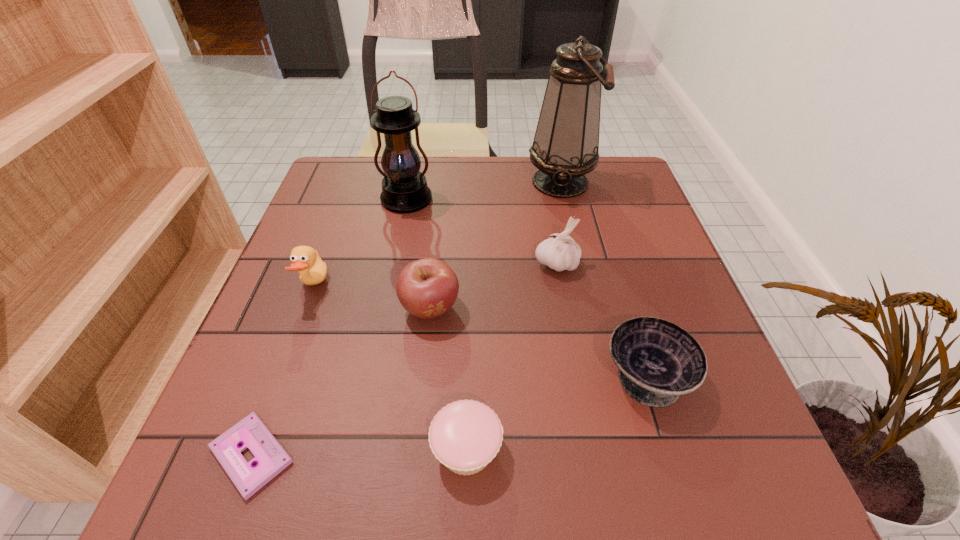
Image resolution: width=960 pixels, height=540 pixels. I want to click on oil lamp, so [566, 143].

This screenshot has width=960, height=540. Identify the location of lantern. click(x=404, y=188).

This screenshot has width=960, height=540. Identify the location of garlic. (560, 252).

Locate an element on the screen. duck is located at coordinates (306, 260).

You are a GUI agent. You are given a task and a screenshot of the screen. Output one action in this format:
    pyautogui.click(x=<x>, y=<y>)
    Task: Click on the apple
    Image resolution: width=960 pixels, height=540 pixels.
    Given the screenshot: What is the action you would take?
    pyautogui.click(x=427, y=288)

You are a GUI agent. You are given a task and a screenshot of the screen. Output one action in this format:
    pyautogui.click(x=<x>, y=<y>)
    Task: Click on the bowl
    The width and height of the screenshot is (960, 540).
    Given the screenshot: What is the action you would take?
    pyautogui.click(x=658, y=361)

The width and height of the screenshot is (960, 540). Find the location of `cupcake`. cupcake is located at coordinates (465, 435).

I want to click on videotape, so click(x=270, y=458).

At what (x,y) coordinates should I click in order to perform the action: click on vacant space located on the right of the oil lamp. Please return your answer as a coordinate pair (x, y). The image size is (960, 540). Looking at the image, I should click on (638, 182).

What is the location of a free spot located above the lantern, indicating its light source? Please provide its 2D coordinates. Your answer should be formatted as a tuple, i.e. [(x, y)], where the tuple contains the x and y coordinates of a point satisfying the conditions above.

[(389, 287)]